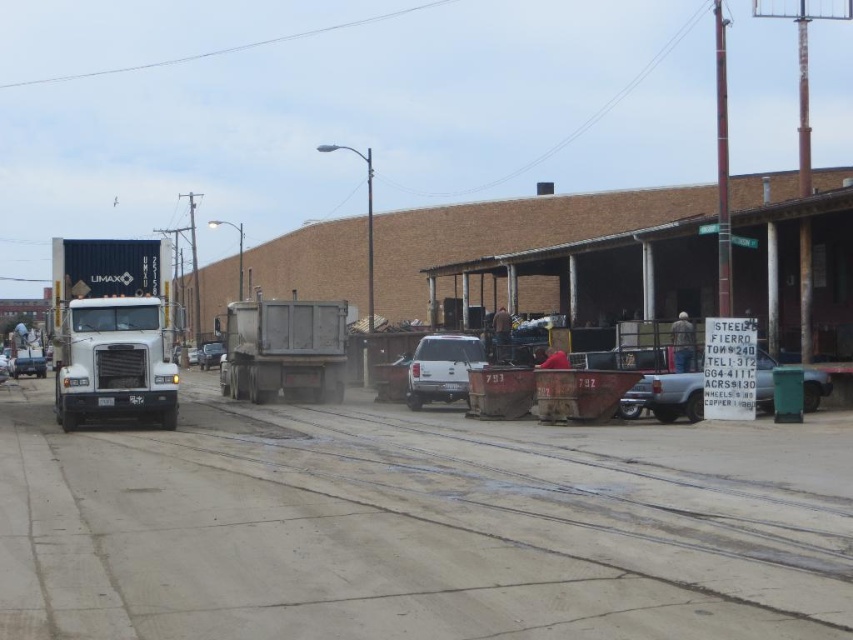
Does white matte truck at center appear over metallic silver car at left?

Indeed, white matte truck at center is positioned over metallic silver car at left.

Between white matte truck at center and metallic silver car at left, which one is positioned higher?

white matte truck at center is higher up.

Based on the photo, who is more distant from viewer, (438, 339) or (32, 355)?

The point (32, 355) is behind.

The image size is (853, 640). In order to click on white matte truck at center in this screenshot , I will do `click(442, 369)`.

Does gray metallic trailer truck at center lie in front of metallic silver car at left?

Yes, it is in front of metallic silver car at left.

Is point (279, 388) more distant than point (15, 378)?

No, (279, 388) is closer to viewer.

Does point (314, 323) come farther from viewer compared to point (39, 362)?

No, (314, 323) is in front of (39, 362).

Identify the location of gray metallic trailer truck at center. (283, 349).

Which is more to the left, white matte truck at left or metallic silver sedan at center?

metallic silver sedan at center

What do you see at coordinates (112, 330) in the screenshot?
I see `white matte truck at left` at bounding box center [112, 330].

At what (x,y) coordinates should I click in order to perform the action: click on white matte truck at left. Please return your answer as a coordinate pair (x, y). Looking at the image, I should click on (112, 330).